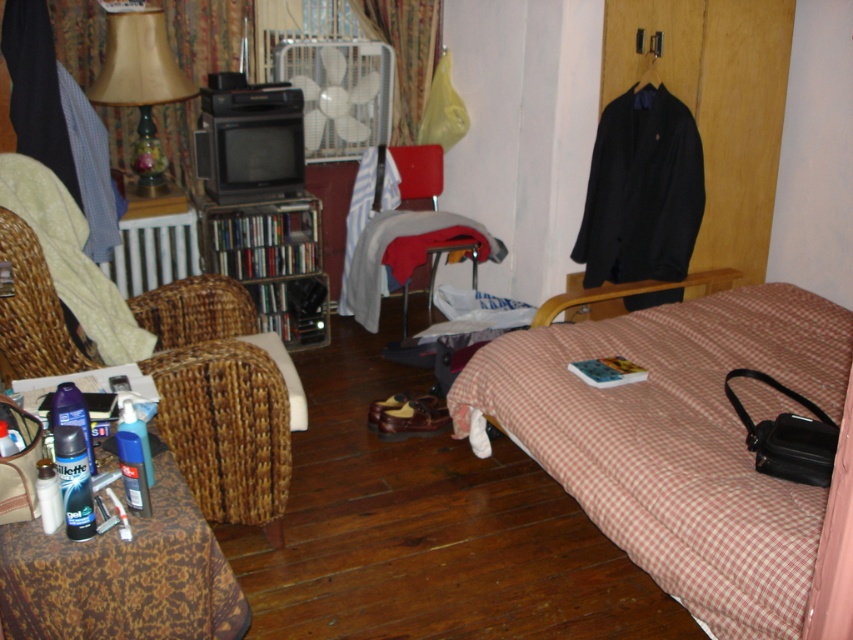
Is point (184, 369) positioned after point (402, 232)?

No, (184, 369) is closer to viewer.

This screenshot has width=853, height=640. Identify the location of woven wicker armchair at left. (219, 406).

The height and width of the screenshot is (640, 853). In order to click on woven wicker armchair at left in this screenshot , I will do `click(219, 406)`.

Does woven wicker armchair at left have a larger size compared to velvet-like curtain at upper center?

Indeed, woven wicker armchair at left has a larger size compared to velvet-like curtain at upper center.

Is woven wicker armchair at left closer to camera compared to velvet-like curtain at upper center?

Yes, woven wicker armchair at left is in front of velvet-like curtain at upper center.

What do you see at coordinates (219, 406) in the screenshot? The width and height of the screenshot is (853, 640). I see `woven wicker armchair at left` at bounding box center [219, 406].

Identify the location of woven wicker armchair at left. Image resolution: width=853 pixels, height=640 pixels. (219, 406).

Can you confirm if matte fabric lamp at upper left is shorter than velvet-like curtain at upper center?

No, matte fabric lamp at upper left is not shorter than velvet-like curtain at upper center.

Who is shorter, matte fabric lamp at upper left or velvet-like curtain at upper center?

velvet-like curtain at upper center is shorter.

What do you see at coordinates (141, 84) in the screenshot? The height and width of the screenshot is (640, 853). I see `matte fabric lamp at upper left` at bounding box center [141, 84].

Identify the location of matte fabric lamp at upper left. (141, 84).